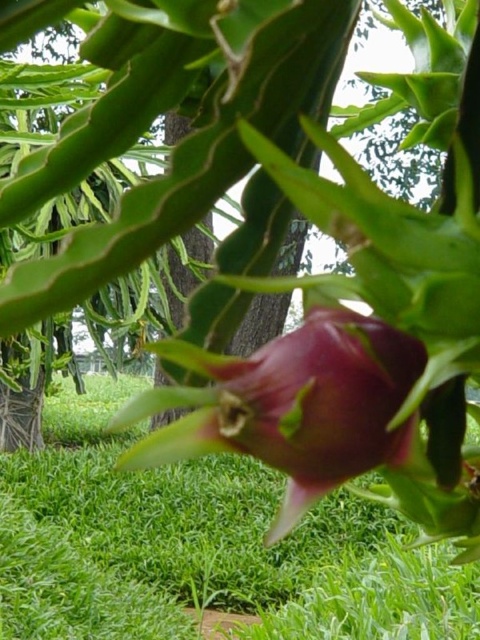
Can you confirm if green grass at center is positioned to the left of purple matte pitaya at center?

Yes, green grass at center is to the left of purple matte pitaya at center.

Does green grass at center appear on the right side of purple matte pitaya at center?

In fact, green grass at center is to the left of purple matte pitaya at center.

Is point (432, 632) positioned before point (314, 314)?

That is False.

Locate an element on the screen. green grass at center is located at coordinates (148, 531).